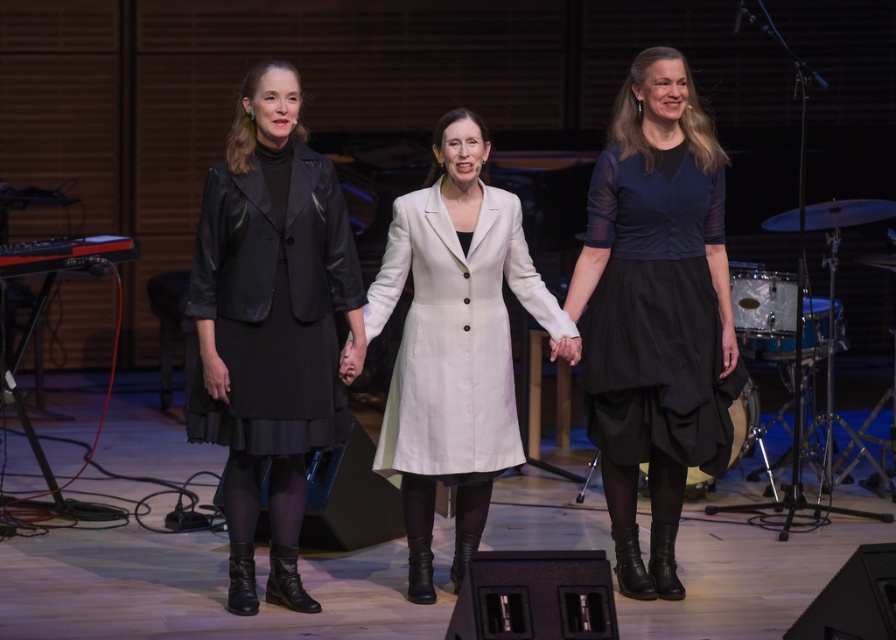
Question: Which point appears closest to the camera in this image?

Choices:
 (A) (665, 412)
 (B) (226, 241)

Answer: (B)

Question: Can you confirm if black leather jacket at center is positioned below matte black dress at right?

Choices:
 (A) no
 (B) yes

Answer: (B)

Question: Based on their relative distances, which object is nearer to the black leather jacket at center?

Choices:
 (A) matte black dress at right
 (B) white fabric coat at center

Answer: (B)

Question: Is matte black dress at right to the right of white fabric coat at center from the viewer's perspective?

Choices:
 (A) no
 (B) yes

Answer: (B)

Question: Can you confirm if matte black dress at right is bigger than white fabric coat at center?

Choices:
 (A) no
 (B) yes

Answer: (A)

Question: Which point is farther to the camera?

Choices:
 (A) (291, 499)
 (B) (679, 381)

Answer: (B)